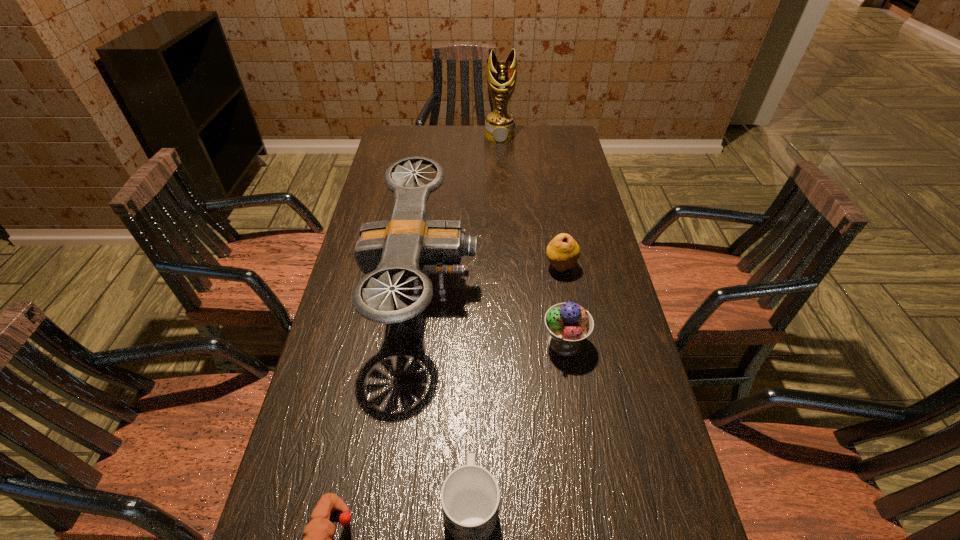
This screenshot has height=540, width=960. What are the coordinates of `vacant space in between the tallest object and the icecream` in the screenshot? It's located at (532, 239).

I want to click on object that stands as the third closest to the shortest object, so click(568, 324).

Identify which object is the nearest to the shortest object. Please provide its 2D coordinates. Your answer should be formatted as a tuple, i.e. [(x, y)], where the tuple contains the x and y coordinates of a point satisfying the conditions above.

[(470, 495)]

Image resolution: width=960 pixels, height=540 pixels. Identify the location of free space that satisfies the following two spatial constraints: 1. on the back side of the icecream; 2. on the left side of the pear. (552, 267).

The height and width of the screenshot is (540, 960). In order to click on free spot that satisfies the following two spatial constraints: 1. on the front-facing side of the award; 2. on the front-facing side of the drone in this screenshot , I will do `click(509, 284)`.

The image size is (960, 540). In order to click on free spot that satisfies the following two spatial constraints: 1. on the front-facing side of the icecream; 2. on the left side of the tallest object in this screenshot , I will do `click(513, 343)`.

At what (x,y) coordinates should I click in order to perform the action: click on vacant space that satisfies the following two spatial constraints: 1. on the front-facing side of the icecream; 2. on the left side of the tallest object. Please return your answer as a coordinate pair (x, y). Looking at the image, I should click on (513, 343).

I want to click on vacant region that satisfies the following two spatial constraints: 1. on the front side of the pear; 2. on the front-facing side of the second tallest object, so click(564, 284).

I want to click on free region that satisfies the following two spatial constraints: 1. on the front-facing side of the farthest object; 2. on the left side of the icecream, so click(513, 343).